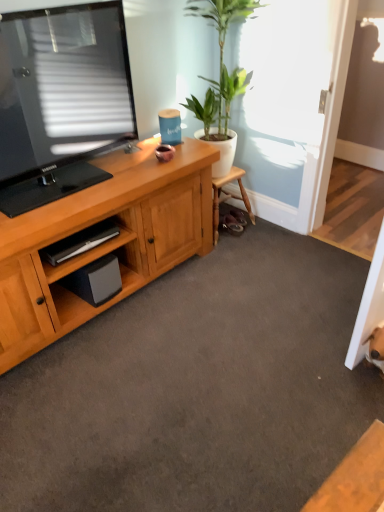
Question: Is there a large distance between black matte speaker at lower left and wooden cabinet at lower left?

Choices:
 (A) yes
 (B) no

Answer: (B)

Question: From the image's perspective, does black matte speaker at lower left appear lower than wooden cabinet at lower left?

Choices:
 (A) no
 (B) yes

Answer: (B)

Question: Does black matte speaker at lower left have a smaller size compared to wooden cabinet at lower left?

Choices:
 (A) no
 (B) yes

Answer: (A)

Question: From a real-world perspective, is black matte speaker at lower left positioned under wooden cabinet at lower left based on gravity?

Choices:
 (A) yes
 (B) no

Answer: (A)

Question: Is black matte speaker at lower left bigger than wooden cabinet at lower left?

Choices:
 (A) yes
 (B) no

Answer: (A)

Question: In the image, is green glossy plant at upper center positioned in front of or behind black matte speaker at lower left?

Choices:
 (A) behind
 (B) front

Answer: (B)

Question: Considering the relative positions of green glossy plant at upper center and black matte speaker at lower left in the image provided, is green glossy plant at upper center to the left or to the right of black matte speaker at lower left?

Choices:
 (A) left
 (B) right

Answer: (B)

Question: From their relative heights in the image, would you say green glossy plant at upper center is taller or shorter than black matte speaker at lower left?

Choices:
 (A) tall
 (B) short

Answer: (A)

Question: From a real-world perspective, is green glossy plant at upper center above or below black matte speaker at lower left?

Choices:
 (A) above
 (B) below

Answer: (A)

Question: In terms of width, does green glossy plant at upper center look wider or thinner when compared to wooden cabinet at lower left?

Choices:
 (A) thin
 (B) wide

Answer: (B)

Question: Visually, is green glossy plant at upper center positioned to the left or to the right of wooden cabinet at lower left?

Choices:
 (A) left
 (B) right

Answer: (B)

Question: From a real-world perspective, relative to wooden cabinet at lower left, is green glossy plant at upper center vertically above or below?

Choices:
 (A) above
 (B) below

Answer: (A)

Question: In terms of height, does green glossy plant at upper center look taller or shorter compared to wooden cabinet at lower left?

Choices:
 (A) tall
 (B) short

Answer: (A)

Question: From a real-world perspective, is black matte speaker at lower left positioned above or below green glossy plant at upper center?

Choices:
 (A) above
 (B) below

Answer: (B)

Question: Is point (94, 268) positioned closer to the camera than point (221, 48)?

Choices:
 (A) closer
 (B) farther

Answer: (A)